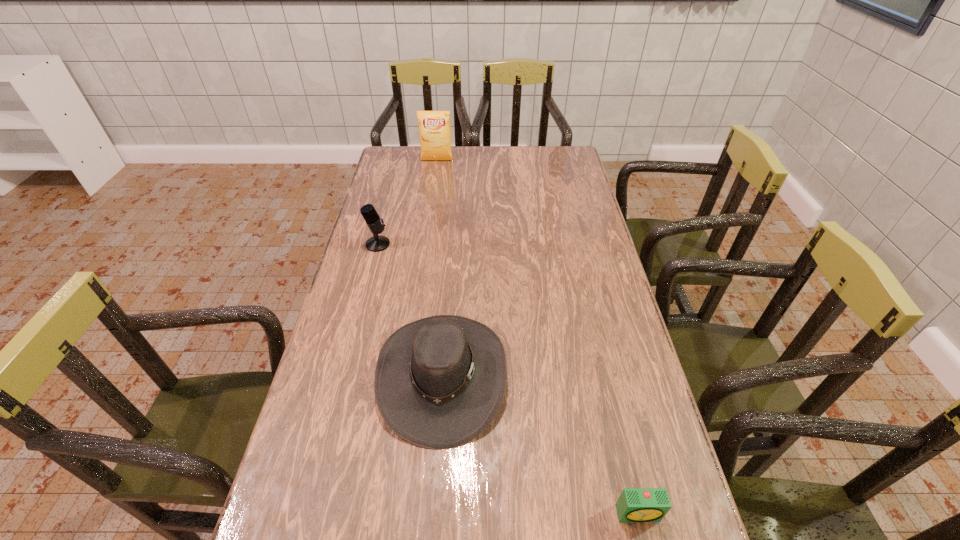
At what (x,y) coordinates should I click in order to perform the action: click on the farthest object. Please return your answer as a coordinate pair (x, y). Looking at the image, I should click on (434, 126).

Where is `crisp (potato chip)`? crisp (potato chip) is located at coordinates (434, 126).

This screenshot has width=960, height=540. I want to click on the leftmost object, so click(377, 243).

Image resolution: width=960 pixels, height=540 pixels. I want to click on microphone, so click(x=377, y=243).

Find the location of `cowboy hat`. cowboy hat is located at coordinates (439, 382).

The image size is (960, 540). I want to click on the nearest object, so click(634, 504).

The height and width of the screenshot is (540, 960). Find the location of `the shortest object`. the shortest object is located at coordinates (634, 504).

Identify the location of free spot located on the front of the crisp (potato chip) with the logo. The height and width of the screenshot is (540, 960). (431, 202).

The width and height of the screenshot is (960, 540). I want to click on free space located 0.330m on the stand of the microphone, so click(488, 244).

Identify the location of vacant space located on the front-facing side of the third farthest object. This screenshot has width=960, height=540. (609, 376).